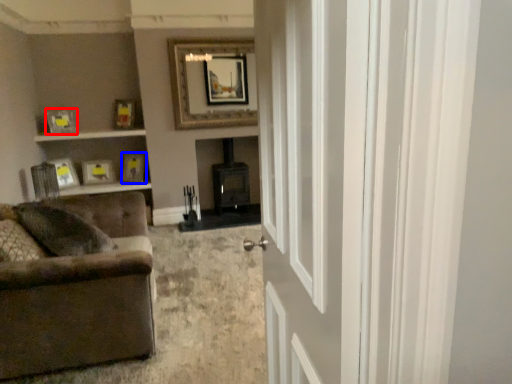
Question: Which object appears closest to the camera in this image, picture frame (highlighted by a red box) or picture frame (highlighted by a blue box)?

Choices:
 (A) picture frame
 (B) picture frame

Answer: (A)